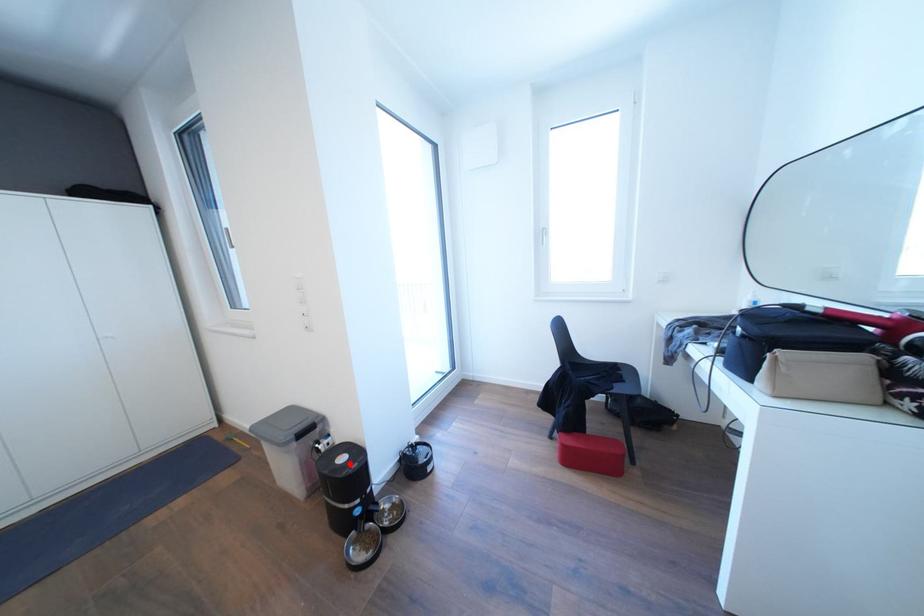
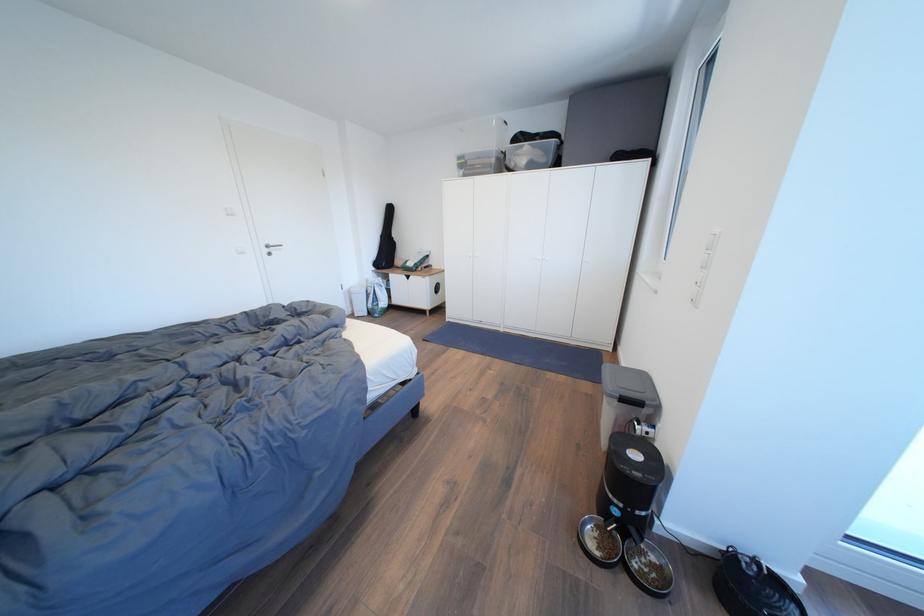
Where in the second image is the point corresponding to the highlighted location from the first image?

(642, 460)